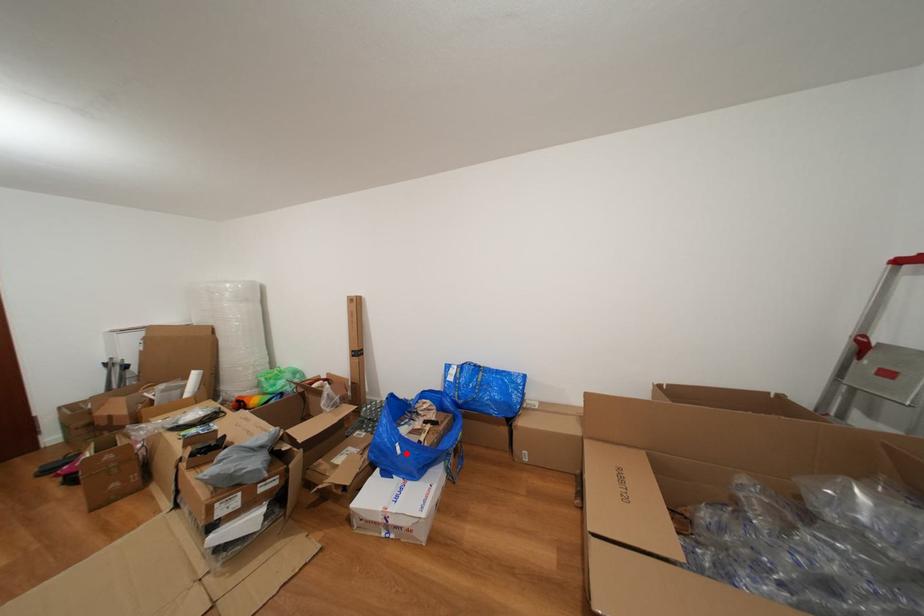
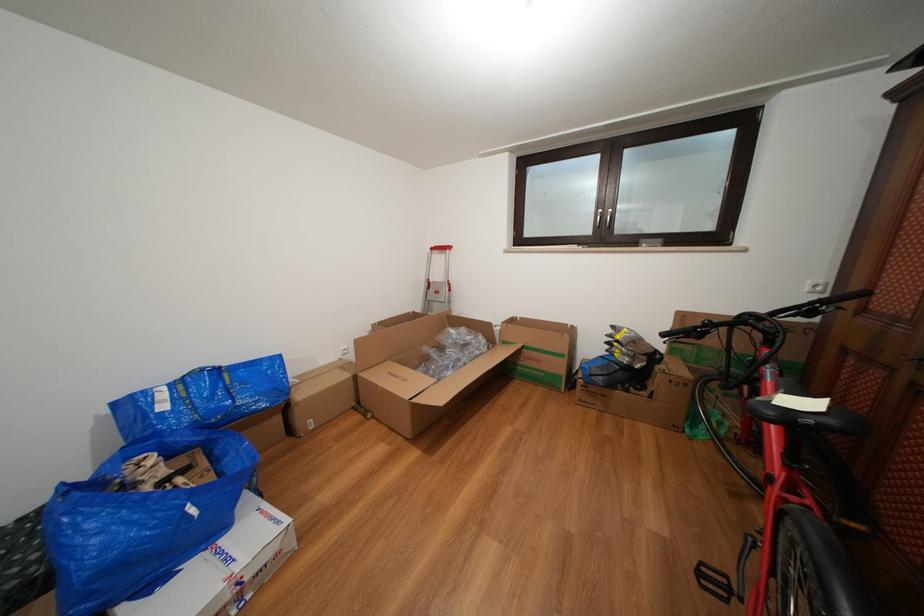
The point at the highlighted location is marked in the first image. Where is the corresponding point in the second image?

(201, 516)